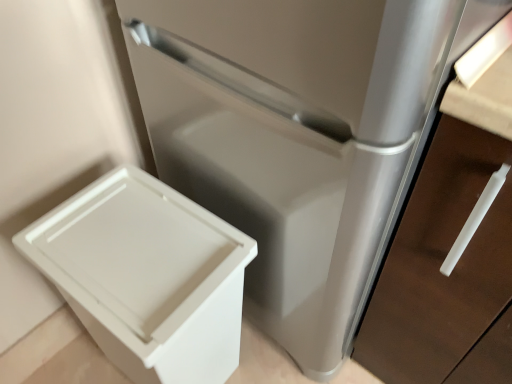
Question: Visually, is white plastic bin at lower left positioned to the left or to the right of satin silver drawer at lower right?

Choices:
 (A) left
 (B) right

Answer: (A)

Question: Considering the positions of white plastic bin at lower left and satin silver drawer at lower right in the image, is white plastic bin at lower left wider or thinner than satin silver drawer at lower right?

Choices:
 (A) thin
 (B) wide

Answer: (A)

Question: Is point (145, 211) positioned closer to the camera than point (440, 372)?

Choices:
 (A) closer
 (B) farther

Answer: (A)

Question: Is satin silver drawer at lower right wider or thinner than white plastic bin at lower left?

Choices:
 (A) wide
 (B) thin

Answer: (A)

Question: From a real-world perspective, is satin silver drawer at lower right physically located above or below white plastic bin at lower left?

Choices:
 (A) below
 (B) above

Answer: (B)

Question: From the image's perspective, relative to white plastic bin at lower left, is satin silver drawer at lower right above or below?

Choices:
 (A) above
 (B) below

Answer: (A)

Question: Based on their sizes in the image, would you say satin silver drawer at lower right is bigger or smaller than white plastic bin at lower left?

Choices:
 (A) small
 (B) big

Answer: (B)